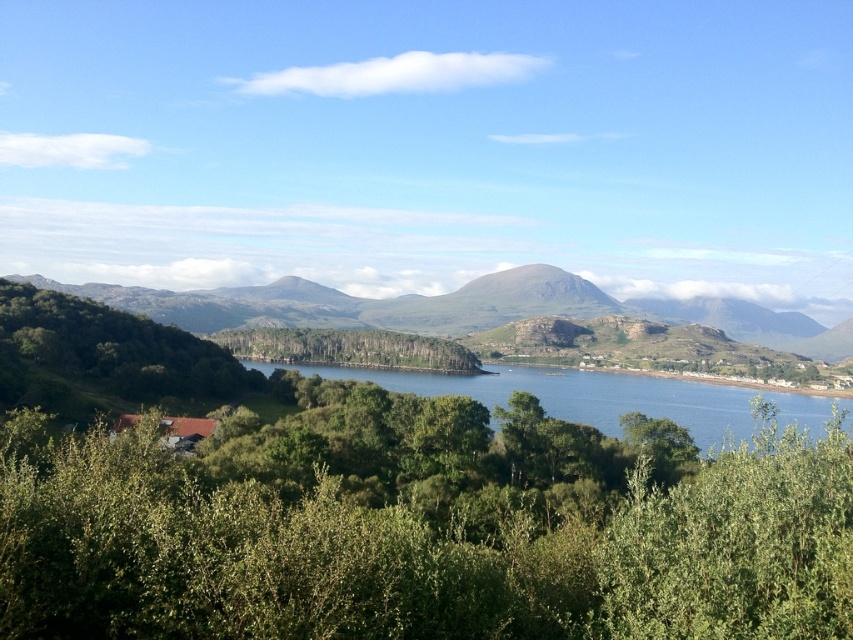
You are standing at the edge of the blue water at center and want to walk towards the green textured hillside at center. Which direction should you head?

You should head to the left because the green textured hillside at center is located to the left of the blue water at center.

Based on the scene description, where exactly is the green leafy tree at left located in terms of coordinates?

The green leafy tree at left is located at point [103,356].

You are standing in the middle of the green leafy tree at center and looking towards the green leafy tree at left. Which tree appears closer to you?

The green leafy tree at left appears closer to you because it is positioned in front of the green leafy tree at center.